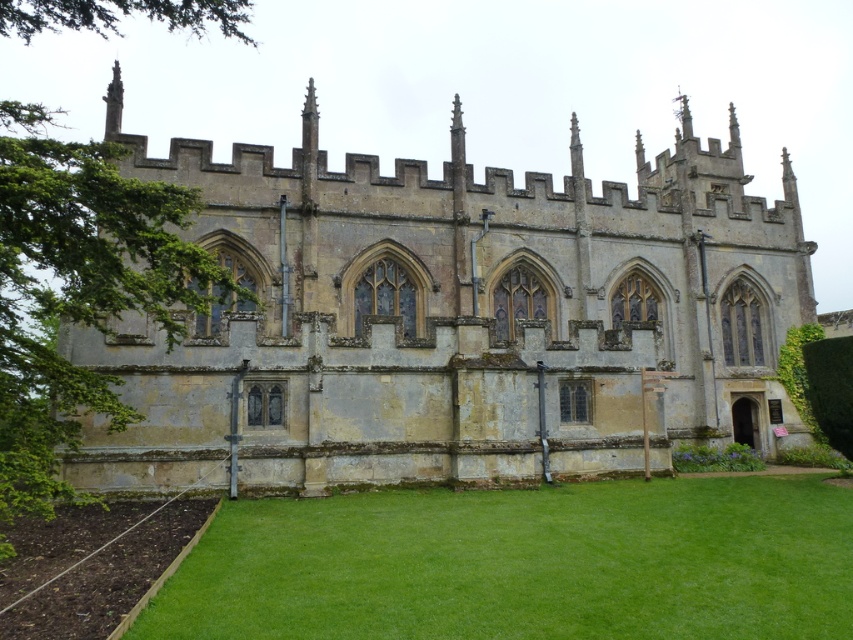
Is stone church at center positioned in front of green grass at lower center?

No.

Who is shorter, stone church at center or green grass at lower center?

With less height is green grass at lower center.

Which is in front, point (479, 333) or point (756, 488)?

Point (479, 333) is in front.

Where is `stone church at center`? stone church at center is located at coordinates (456, 317).